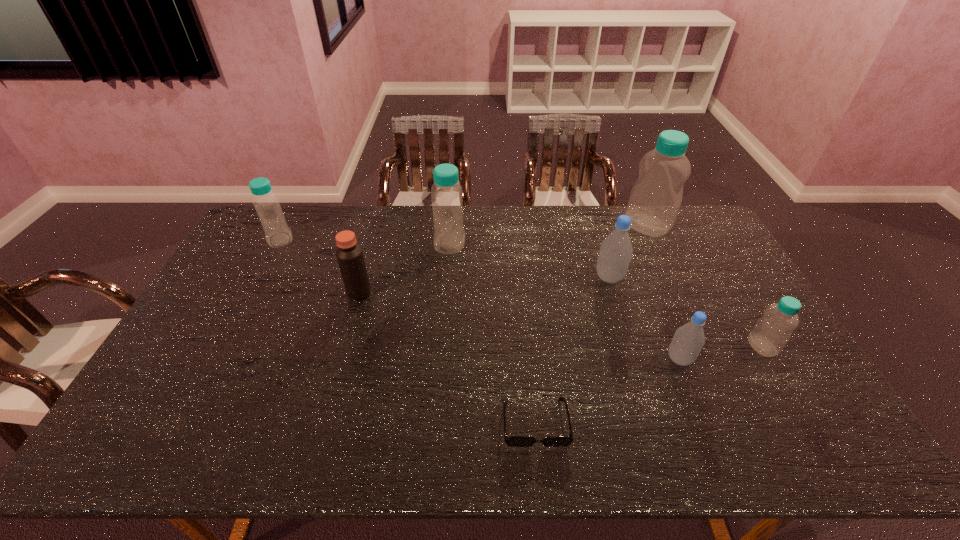
The image size is (960, 540). Find the location of `the third blue bottle from left to right`. the third blue bottle from left to right is located at coordinates (655, 199).

Where is `the biggest blue bottle`? The height and width of the screenshot is (540, 960). the biggest blue bottle is located at coordinates (655, 199).

Locate an element on the screen. This screenshot has height=540, width=960. the second biggest blue bottle is located at coordinates (446, 193).

Locate an element on the screen. This screenshot has width=960, height=540. the sixth object from right to left is located at coordinates coord(446,193).

This screenshot has width=960, height=540. I want to click on the leftmost object, so click(x=277, y=233).

Where is `the leftmost bottle`? The height and width of the screenshot is (540, 960). the leftmost bottle is located at coordinates (277, 233).

Find the location of a particular element. The width and height of the screenshot is (960, 540). the third bottle from left to right is located at coordinates (615, 253).

Find the location of a particular element. Image resolution: width=960 pixels, height=540 pixels. the left gray bottle is located at coordinates (615, 253).

Where is `the seventh object from right to left`? The height and width of the screenshot is (540, 960). the seventh object from right to left is located at coordinates (349, 254).

Locate an element on the screen. vinegar is located at coordinates (349, 254).